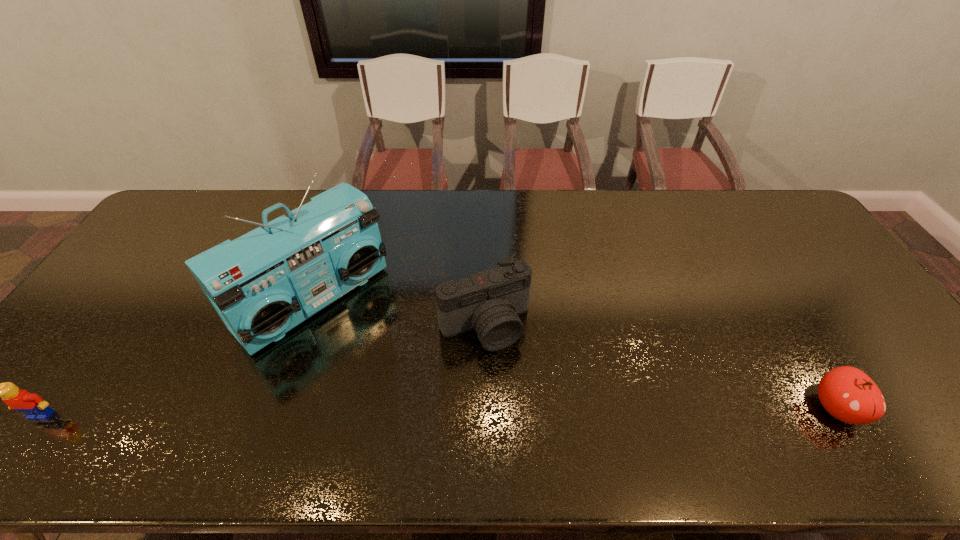
The height and width of the screenshot is (540, 960). What are the coordinates of `free space located 0.150m at the lens of the second object from right to left` in the screenshot? It's located at (529, 404).

This screenshot has width=960, height=540. I want to click on free space located 0.120m at the lens of the second object from right to left, so point(523,394).

Locate an element on the screen. This screenshot has width=960, height=540. free space located 0.120m at the lens of the second object from right to left is located at coordinates (523, 394).

At what (x,y) coordinates should I click in order to perform the action: click on Lego present at the near edge. Please return your answer as a coordinate pair (x, y). Looking at the image, I should click on (31, 404).

This screenshot has height=540, width=960. Find the location of `apple situated at the near edge`. apple situated at the near edge is located at coordinates (848, 394).

Find the location of a particular element. object that is positioned at the left edge is located at coordinates (31, 404).

This screenshot has width=960, height=540. What are the coordinates of `object that is at the near left corner` in the screenshot? It's located at (31, 404).

The image size is (960, 540). Identify the location of free space at the far edge. (381, 205).

In the image, there is a desktop. Identify the location of free space at the near edge. Image resolution: width=960 pixels, height=540 pixels. click(653, 404).

Image resolution: width=960 pixels, height=540 pixels. I want to click on vacant region at the left edge of the desktop, so click(53, 366).